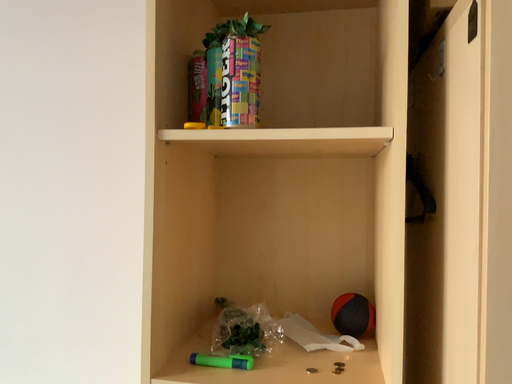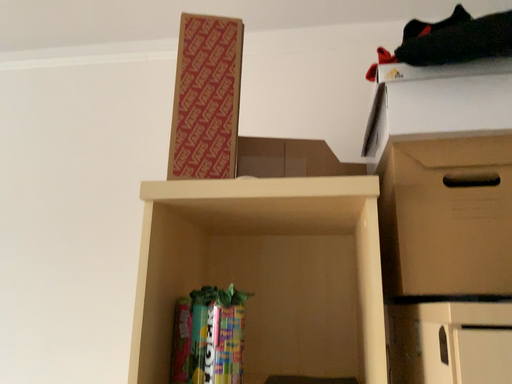
Question: Which way did the camera rotate in the video?

Choices:
 (A) rotated downward
 (B) rotated upward

Answer: (B)